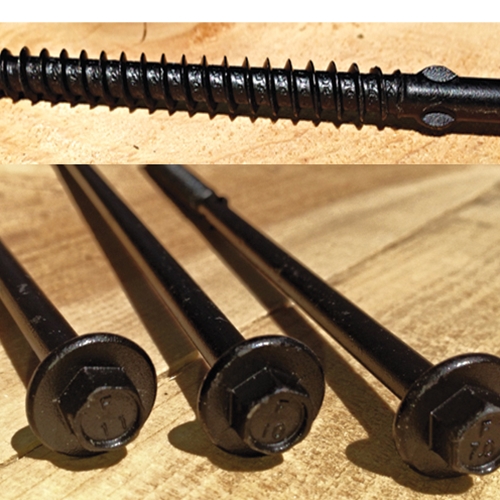
Locate an element on the screen. washer is located at coordinates (73, 345), (271, 355), (464, 363).